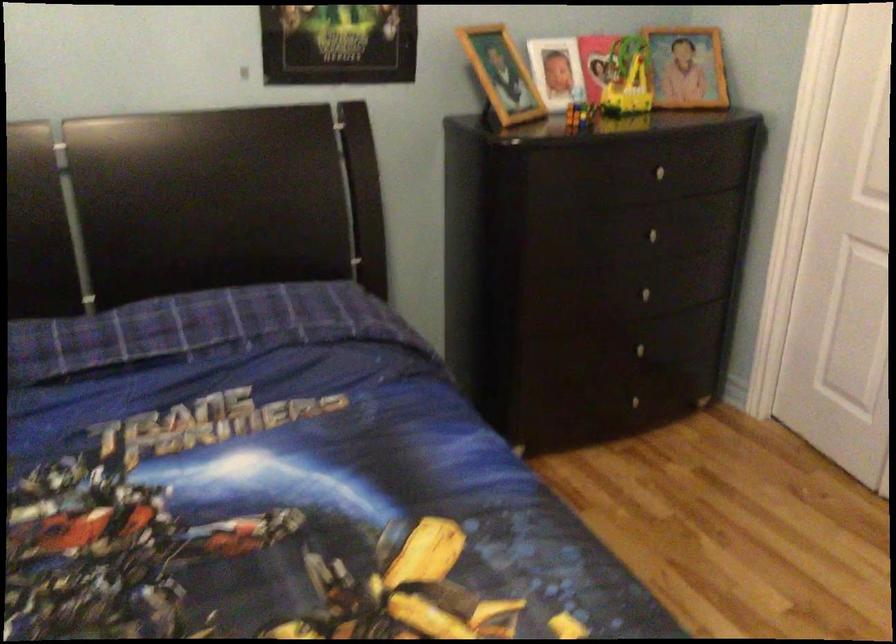
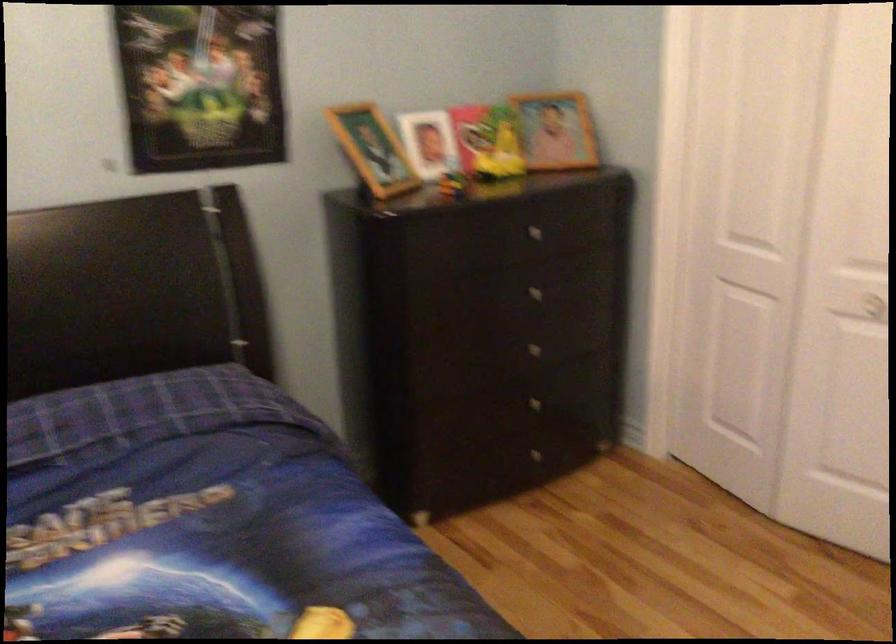
Locate, in the second image, the point that corresponds to (x=657, y=237) in the first image.

(538, 292)